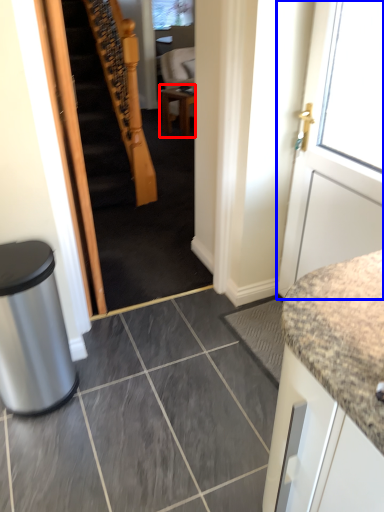
Question: Which of the following is the farthest to the observer, table (highlighted by a red box) or door (highlighted by a blue box)?

Choices:
 (A) table
 (B) door

Answer: (A)